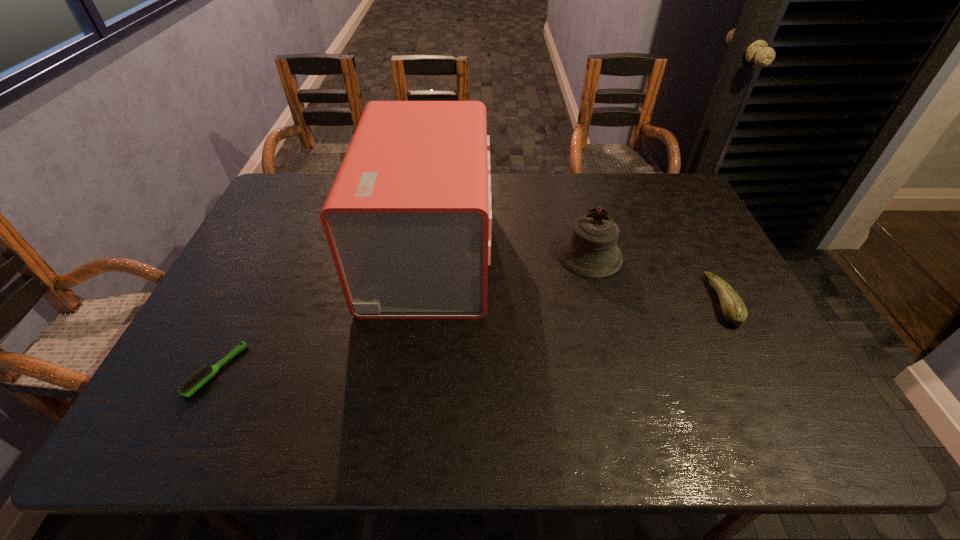
In the image, there is a desktop. Where is `blank space at the far left corner`? blank space at the far left corner is located at coordinates (319, 178).

At what (x,y) coordinates should I click in order to perform the action: click on vacant space at the near left corner of the desktop. Please return your answer as a coordinate pair (x, y). This screenshot has height=540, width=960. Looking at the image, I should click on (170, 437).

You are a GUI agent. You are given a task and a screenshot of the screen. Output one action in this format:
    pyautogui.click(x=<x>, y=<y>)
    Task: Click on the vacant space at the far right corner of the desktop
    The image size is (960, 540).
    Given the screenshot: What is the action you would take?
    pyautogui.click(x=669, y=196)

Locate an element on the screen. free spot between the box and the third shortest object is located at coordinates (509, 254).

Identify the location of vacant space that's between the leftmost object and the tallest object. The height and width of the screenshot is (540, 960). (322, 312).

The height and width of the screenshot is (540, 960). I want to click on empty space that is in between the tallest object and the third object from left to right, so click(509, 254).

You are a GUI agent. You are given a task and a screenshot of the screen. Output one action in this format:
    pyautogui.click(x=<x>, y=<y>)
    Task: Click on the empty space that is in between the second shortest object and the hairbrush
    The width and height of the screenshot is (960, 540).
    Given the screenshot: What is the action you would take?
    pyautogui.click(x=468, y=336)

Identify the location of free area in between the tallest object and the third tallest object. This screenshot has height=540, width=960. (575, 276).

Find the location of a particular element. Image resolution: width=960 pixels, height=540 pixels. free spot between the second object from left to right and the bell is located at coordinates (509, 254).

You are a GUI agent. You are given a task and a screenshot of the screen. Output one action in this format:
    pyautogui.click(x=<x>, y=<y>)
    Task: Click on the free space between the shortest object and the second object from left to right
    The width and height of the screenshot is (960, 540).
    Given the screenshot: What is the action you would take?
    pyautogui.click(x=322, y=312)